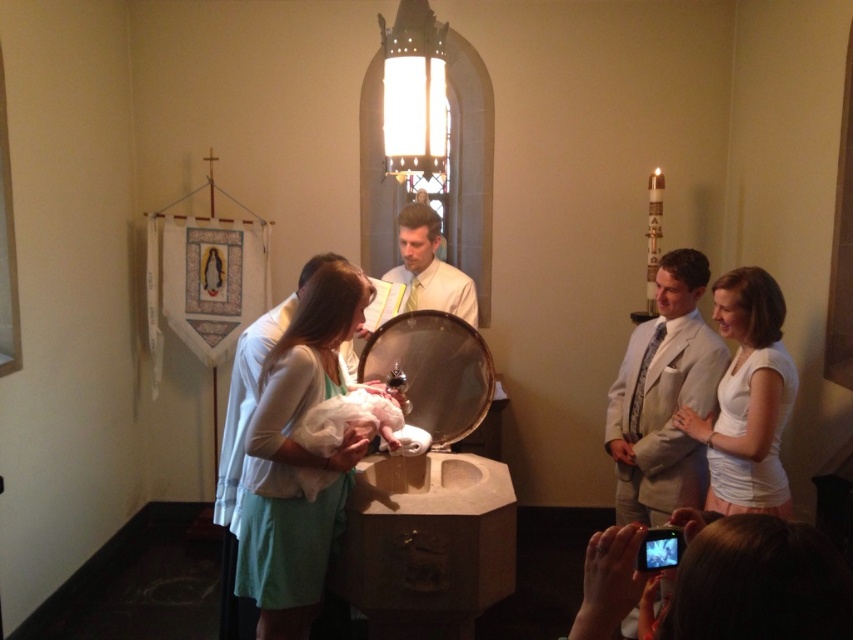
Which is behind, point (292, 458) or point (686, 397)?

Positioned behind is point (686, 397).

Is point (328, 468) farther from viewer compared to point (701, 468)?

No, it is not.

Between point (280, 504) and point (677, 323), which one is positioned behind?

The point (677, 323) is behind.

This screenshot has width=853, height=640. In order to click on light green fabric dress at center in this screenshot , I will do `click(297, 458)`.

Between point (616, 493) and point (437, 234), which one is positioned behind?

The point (437, 234) is more distant.

Is point (704, 468) less distant than point (434, 250)?

Yes, point (704, 468) is in front of point (434, 250).

Locate an element on the screen. white textured suit at right is located at coordinates (664, 396).

Does light green fabric dress at center have a larger size compared to white glossy shirt at center?

Correct, light green fabric dress at center is larger in size than white glossy shirt at center.

Which is behind, point (264, 417) or point (451, 307)?

Positioned behind is point (451, 307).

Identify the location of light green fabric dress at center. This screenshot has height=640, width=853. (297, 458).